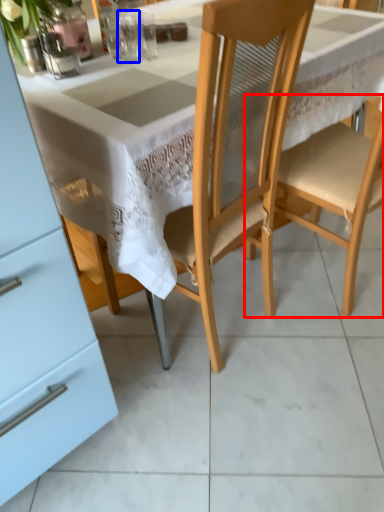
Question: Which point is further to the camera, chair (highlighted by a red box) or tableware (highlighted by a blue box)?

Choices:
 (A) chair
 (B) tableware

Answer: (B)